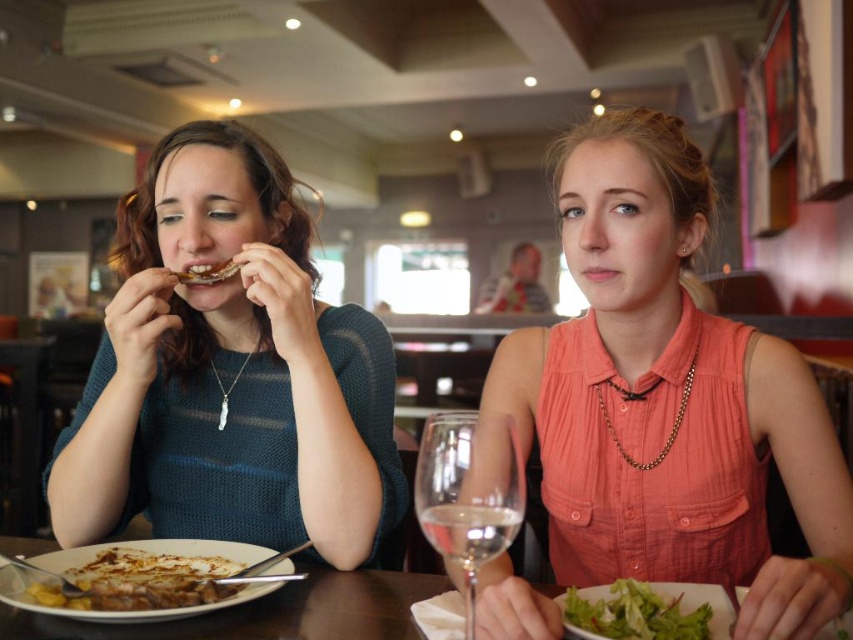
From the picture: Is transparent glass wine glass at lower center further to the viewer compared to green leafy salad at lower center?

No, it is in front of green leafy salad at lower center.

Describe the element at coordinates (468, 492) in the screenshot. I see `transparent glass wine glass at lower center` at that location.

Where is `transparent glass wine glass at lower center`? transparent glass wine glass at lower center is located at coordinates (468, 492).

Based on the photo, is golden brown bread at lower left above green leafy salad at lower center?

No, golden brown bread at lower left is not above green leafy salad at lower center.

Consider the image. Between golden brown bread at lower left and green leafy salad at lower center, which one appears on the left side from the viewer's perspective?

Positioned to the left is golden brown bread at lower left.

This screenshot has width=853, height=640. Describe the element at coordinates (136, 580) in the screenshot. I see `golden brown bread at lower left` at that location.

The height and width of the screenshot is (640, 853). What are the coordinates of `golden brown bread at lower left` in the screenshot? It's located at (136, 580).

Is transparent glass wine glass at lower center below brown crispy bread at center?

Indeed, transparent glass wine glass at lower center is positioned under brown crispy bread at center.

Does point (473, 589) come farther from viewer compared to point (183, 280)?

No, it is in front of (183, 280).

Identify the location of transparent glass wine glass at lower center. (468, 492).